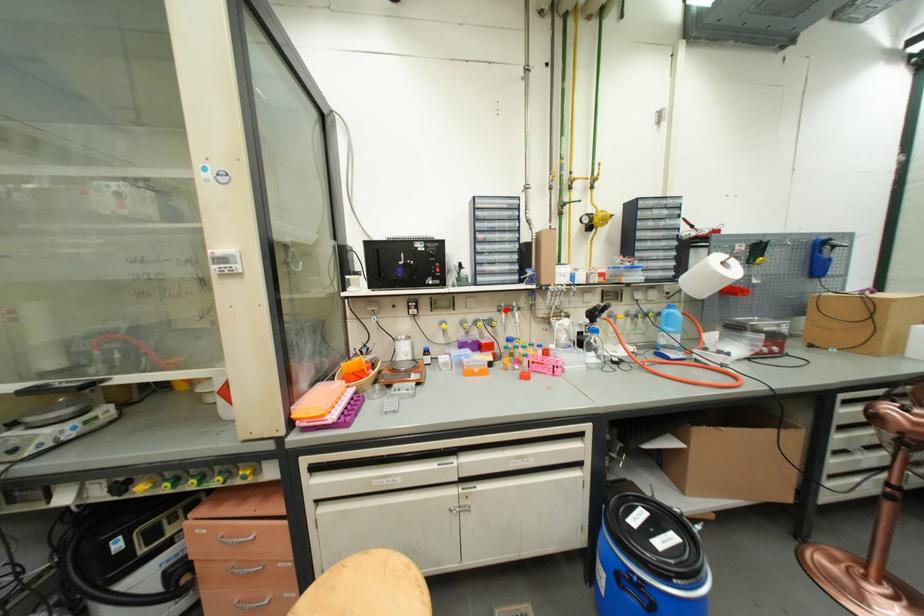
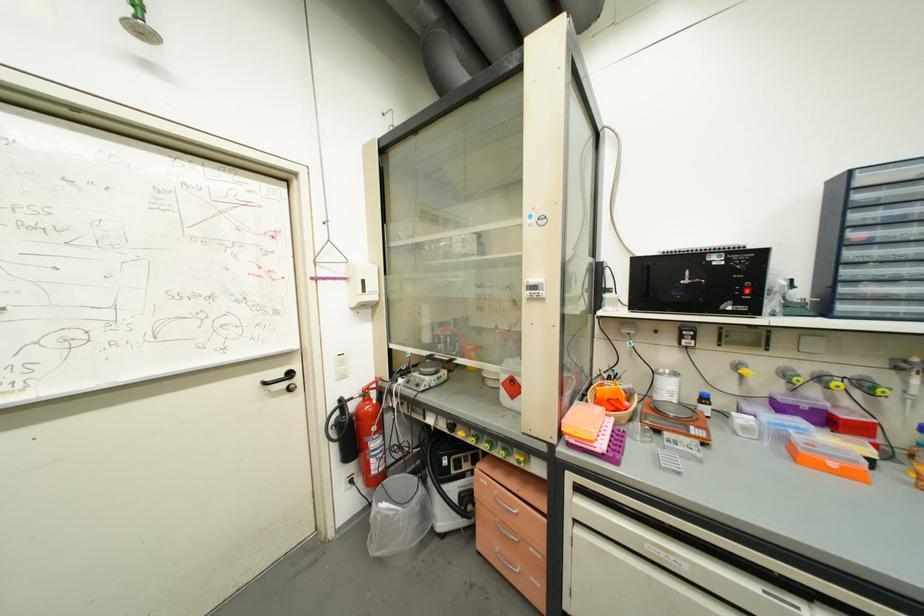
Where in the second image is the point corresponding to the highlighted location from the first image?

(909, 367)